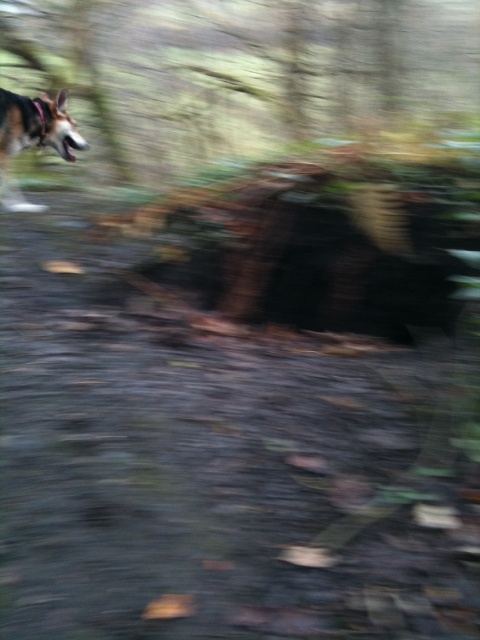
Does brown rough bark at upper left have a lesser width compared to brown fur dog at left?

No, brown rough bark at upper left is not thinner than brown fur dog at left.

Is point (445, 28) behind point (23, 138)?

Yes, it is.

Between point (148, 22) and point (55, 132), which one is positioned behind?

Point (148, 22)

In order to click on brown rough bark at upper left in this screenshot , I will do `click(275, 70)`.